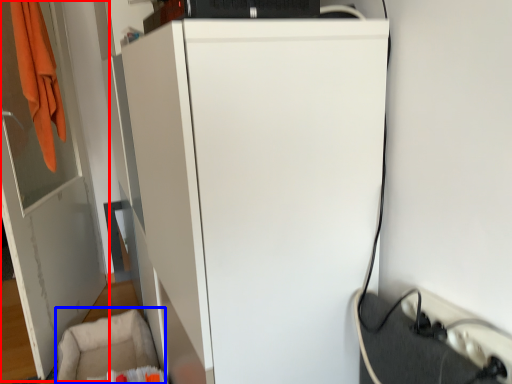
Question: Which object appears farthest to the camera in this image, door (highlighted by a red box) or swivel chair (highlighted by a blue box)?

Choices:
 (A) door
 (B) swivel chair

Answer: (B)